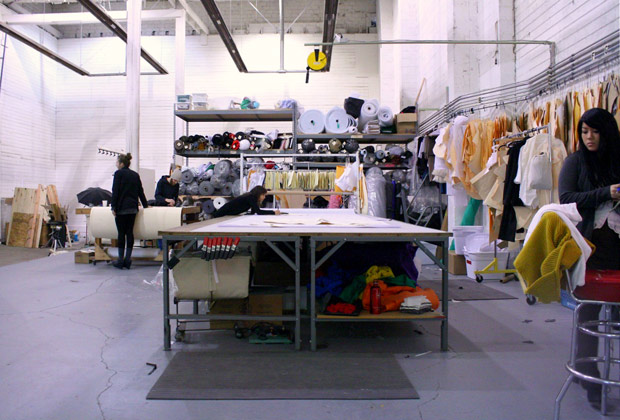
Find the location of a particular element. This screenshot has height=420, width=620. grey mat on floor is located at coordinates (467, 292).